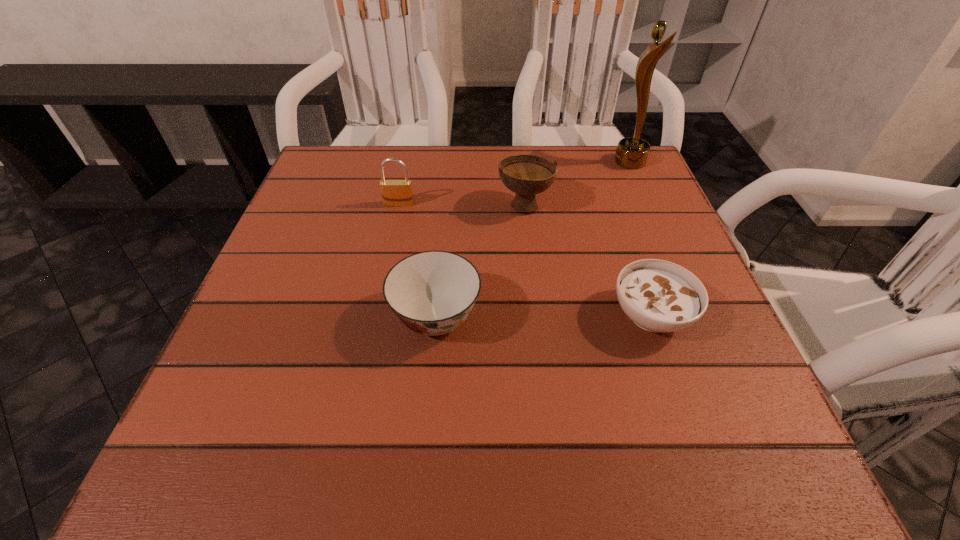
I want to click on award, so click(x=632, y=152).

Find the location of a particular element. This screenshot has width=960, height=540. the farthest object is located at coordinates (632, 152).

What are the coordinates of `padlock` in the screenshot? It's located at (395, 193).

Locate an element on the screen. the tallest soup bowl is located at coordinates (526, 175).

Where is `the third object from left to right`? This screenshot has height=540, width=960. the third object from left to right is located at coordinates (526, 175).

This screenshot has width=960, height=540. What are the coordinates of `the fourth tallest object` in the screenshot? It's located at (432, 292).

Find the location of a particular element. The width and height of the screenshot is (960, 540). the second tallest soup bowl is located at coordinates (432, 292).

The image size is (960, 540). In order to click on the shortest object in this screenshot , I will do `click(658, 296)`.

Where is `the shortest soup bowl`? The width and height of the screenshot is (960, 540). the shortest soup bowl is located at coordinates (658, 296).

At what (x,y) coordinates should I click in order to perform the action: click on blank area located on the front-facing side of the tallest object. Please return your answer as a coordinate pair (x, y). The width and height of the screenshot is (960, 540). Looking at the image, I should click on (590, 162).